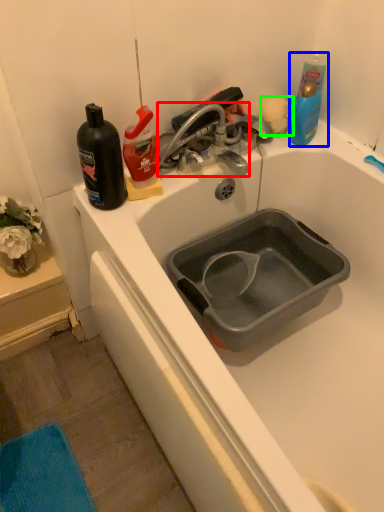
Question: Estimate the real-world distances between objects in this image. Which object is farther from tap (highlighted by a red box), cleaning product (highlighted by a blue box) or flower (highlighted by a green box)?

Choices:
 (A) cleaning product
 (B) flower

Answer: (A)